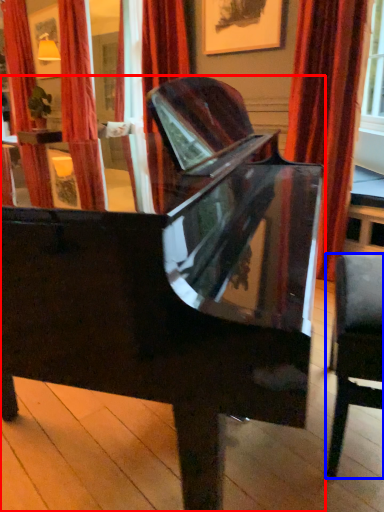
Question: Which point is further to the camera, piano (highlighted by a red box) or chair (highlighted by a blue box)?

Choices:
 (A) piano
 (B) chair

Answer: (B)